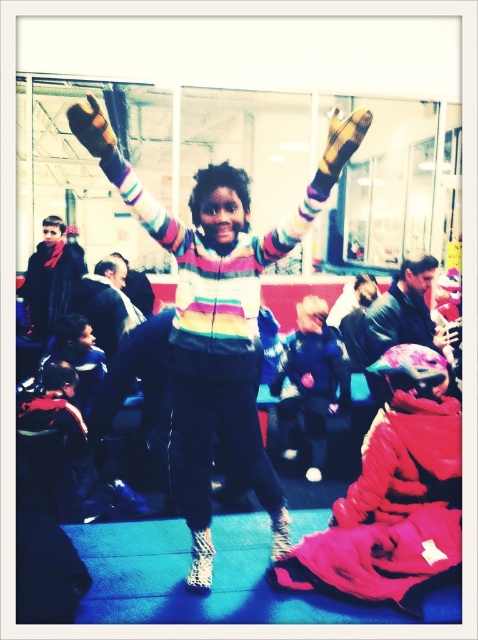
You are a photographer at the event and want to capture both the striped sweater at center and the shiny blue jacket at center in the same frame. Which object should you focus on first to ensure both are in the frame?

You should focus on the striped sweater at center first since it is larger than the shiny blue jacket at center, allowing you to frame the smaller jacket within the same shot more easily.

You are a photographer standing at the entrance of the event venue. You want to take a photo of both the striped sweater at center and the shiny blue jacket at center in the same frame. The camera you are using has a minimum focus distance of 1 meter. Can you capture both items in the same shot without moving closer than 1 meter?

The distance between the striped sweater at center and the shiny blue jacket at center is 1.22 meters. Since the camera requires a minimum focus distance of 1 meter, you can capture both items in the same shot as the distance between them is within the camera range.

Based on the scene description, which object is taller between the striped sweater at center and the shiny blue jacket at center?

The striped sweater at center is taller than the shiny blue jacket at center according to the description.